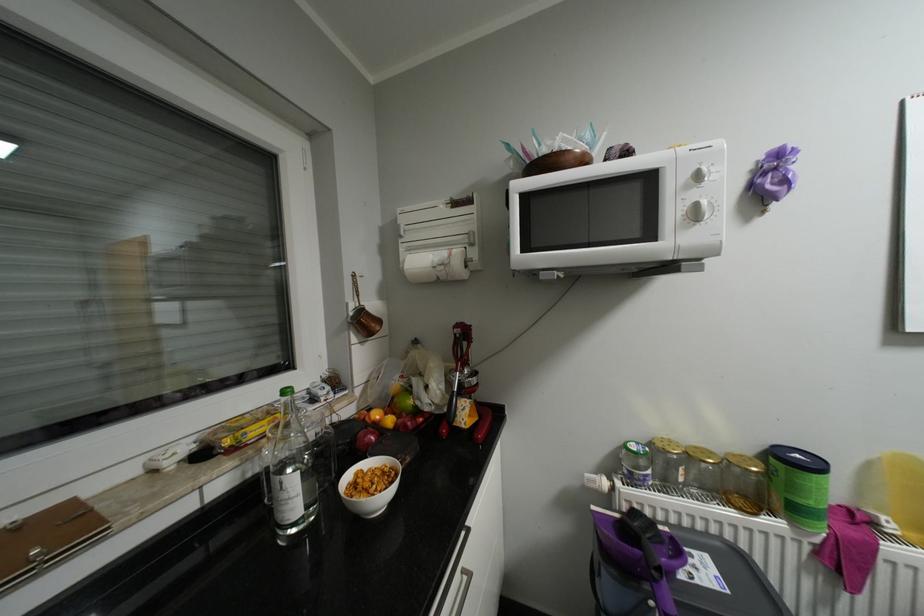
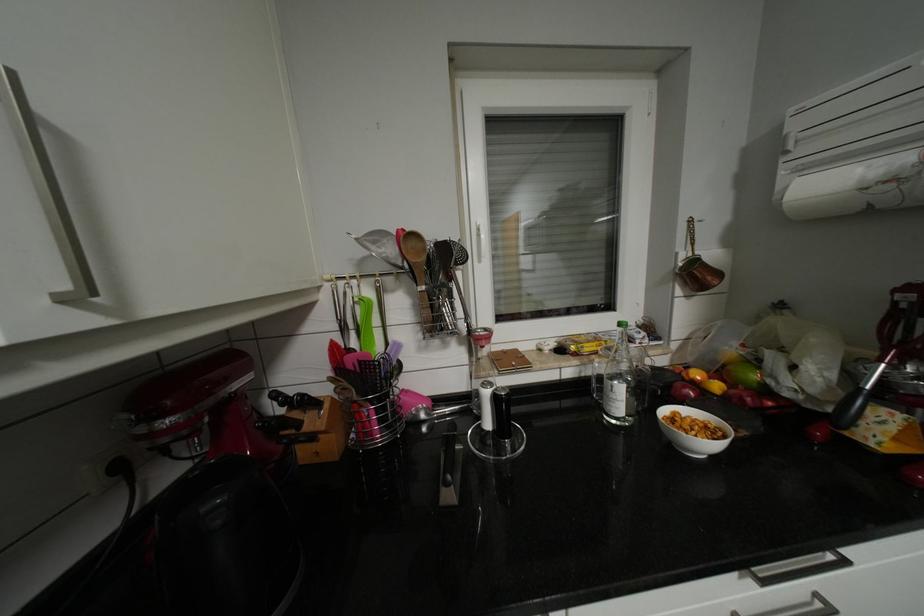
Where in the second image is the point corresponding to (383,415) from the first image?

(704, 374)